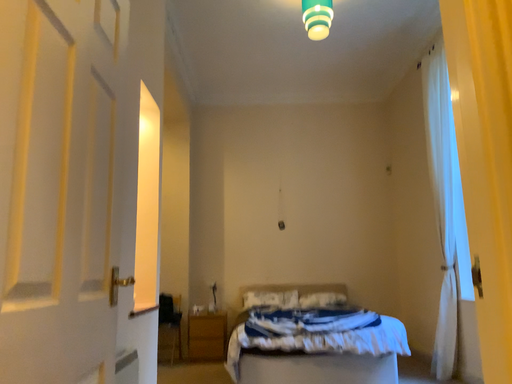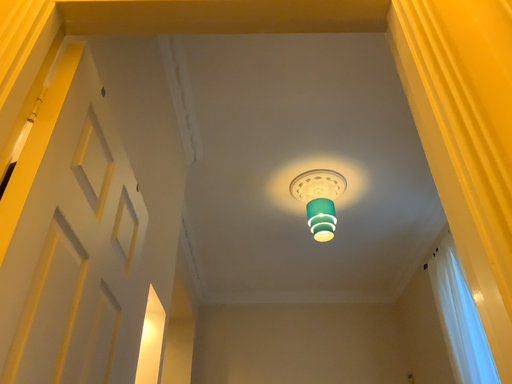
Question: How did the camera likely rotate when shooting the video?

Choices:
 (A) rotated upward
 (B) rotated downward

Answer: (A)